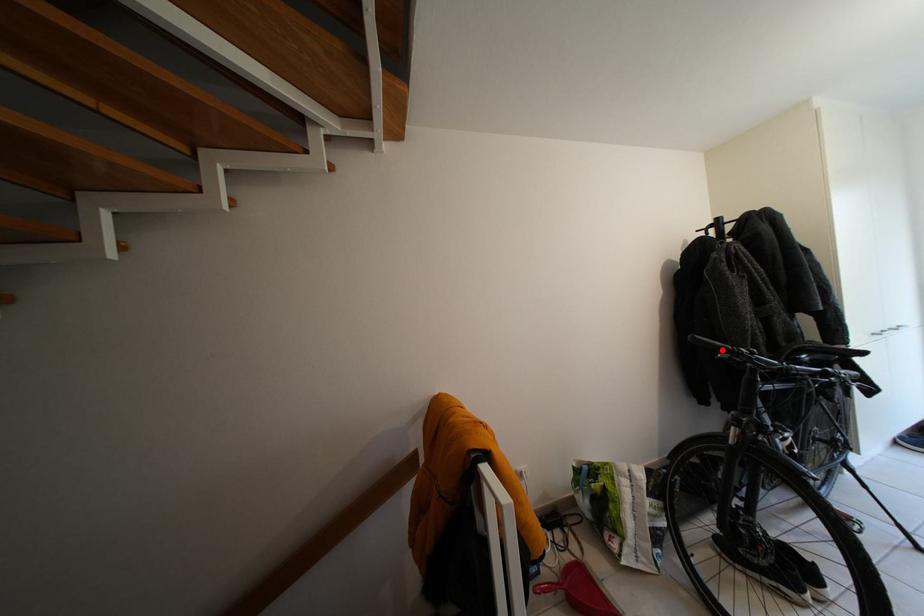
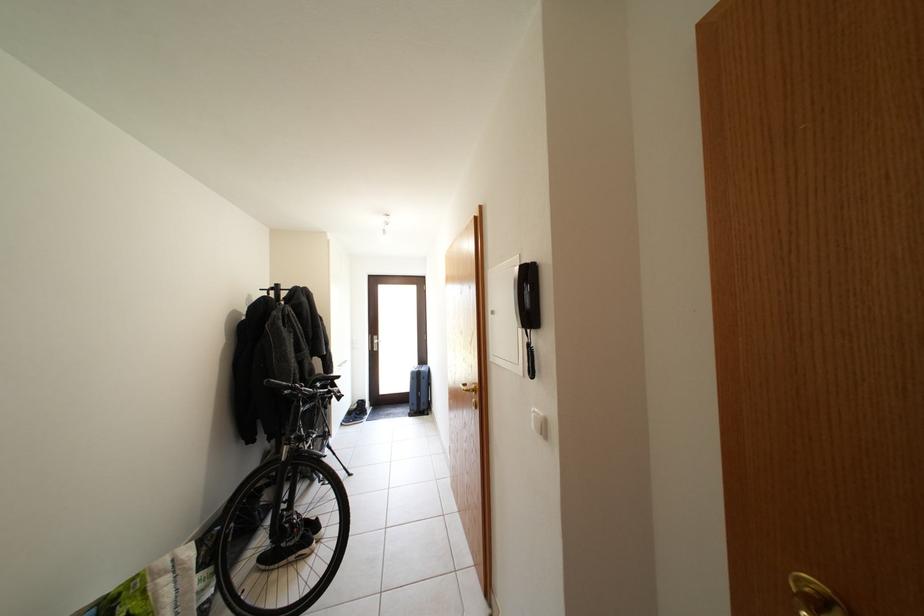
Question: I am providing you with two images of the same scene from different viewpoints. Given a red point in image1, look at the same physical point in image2. Is it:

Choices:
 (A) Closer to the viewpoint
 (B) Farther from the viewpoint

Answer: (A)